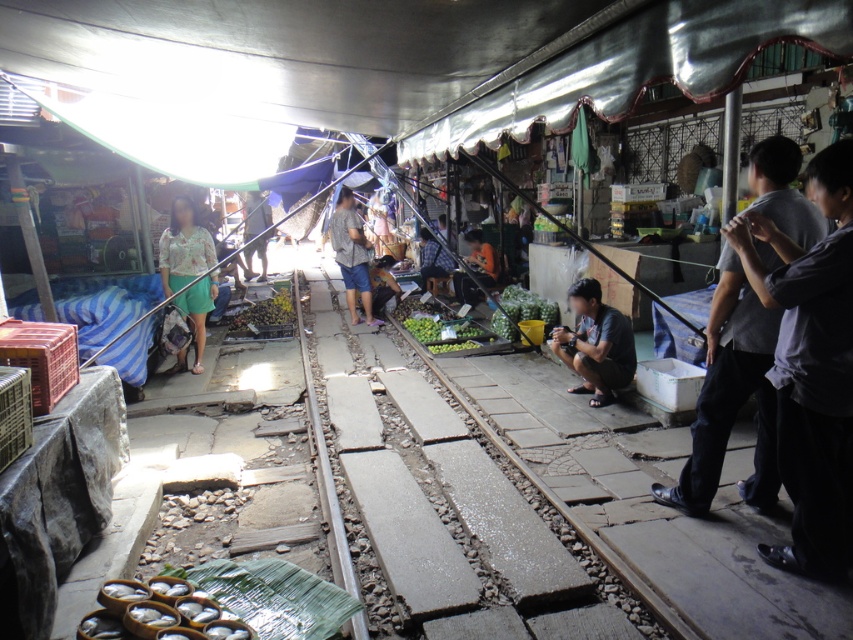
Question: Which of the following is the closest to the observer?

Choices:
 (A) (186, 234)
 (B) (622, 314)

Answer: (B)

Question: Can you confirm if dark gray shirt at center is thinner than floral fabric shirt at center?

Choices:
 (A) no
 (B) yes

Answer: (B)

Question: Does dark gray shirt at center appear over floral fabric shirt at center?

Choices:
 (A) yes
 (B) no

Answer: (B)

Question: Which object is farther from the camera taking this photo?

Choices:
 (A) matte gray shirt at center
 (B) dark gray shirt at right

Answer: (A)

Question: Which object is the farthest from the matte gray shirt at center?

Choices:
 (A) floral fabric shirt at center
 (B) dark gray shirt at center
 (C) dark gray shirt at right

Answer: (C)

Question: From the image, what is the correct spatial relationship of dark gray shirt at right in relation to dark gray shirt at center?

Choices:
 (A) below
 (B) above

Answer: (A)